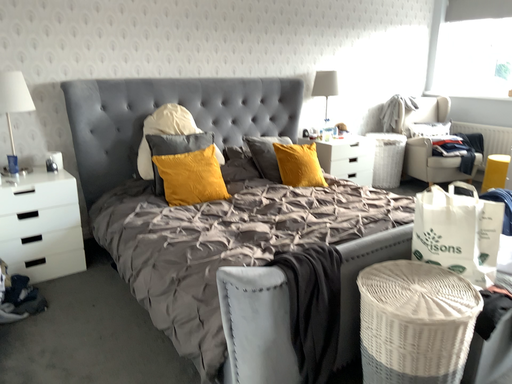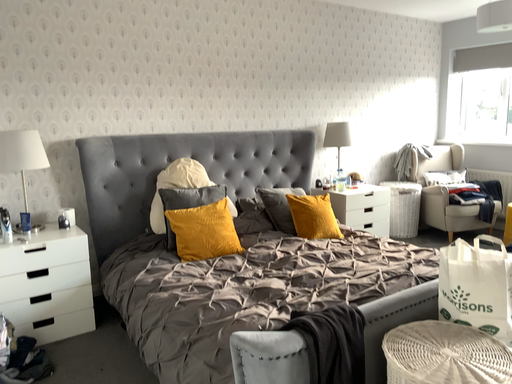
Question: How did the camera likely rotate when shooting the video?

Choices:
 (A) rotated downward
 (B) rotated upward

Answer: (B)